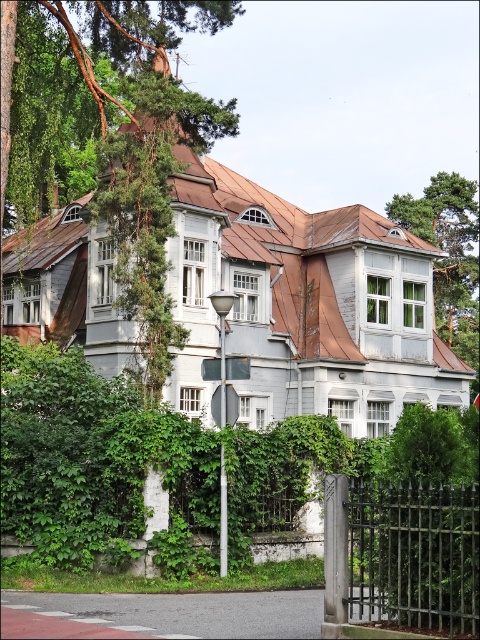
You are a delivery person with a 15 feet long package that needs to be carried through the path between the black wrought iron gate at center and the metallic pole at center. Can you pass through this path without tilting the package?

The distance between the black wrought iron gate at center and the metallic pole at center is 18.57 feet, which is greater than the 15 feet length of the package. Therefore, you can pass through the path without tilting the package.

You are a window cleaner standing on the ground floor of the building. You notice the green leafy tree at upper right and the metallic pole at center. Which object is higher from the ground?

The green leafy tree at upper right is taller than the metallic pole at center, so the green leafy tree at upper right is higher from the ground.